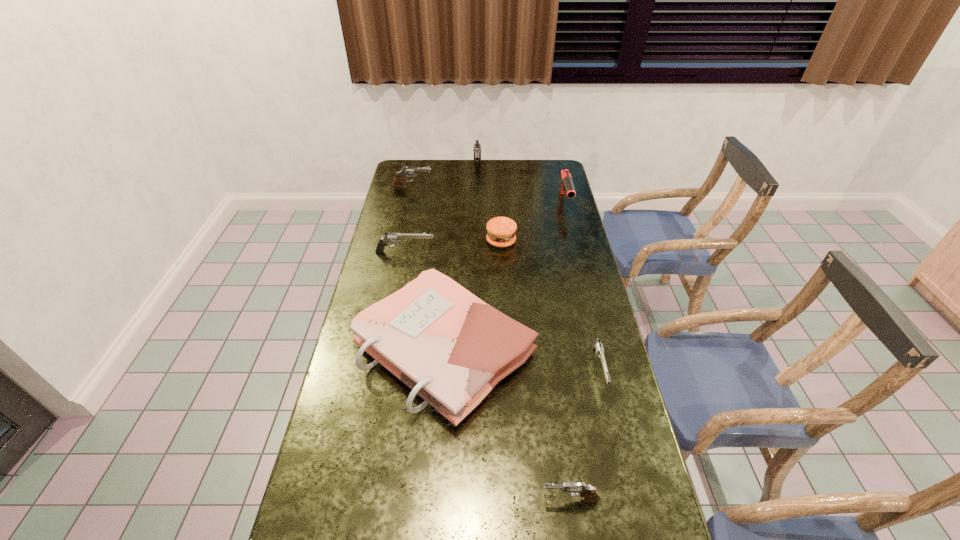
Find the location of `blank space located 0.260m at the barrel of the nearest pistol`. blank space located 0.260m at the barrel of the nearest pistol is located at coordinates (429, 500).

Locate an element on the screen. vacant region located at the barrel of the nearest pistol is located at coordinates (391, 500).

Identify the location of vacant space situated 0.240m on the front-facing side of the right silver pistol. The height and width of the screenshot is (540, 960). (626, 484).

Image resolution: width=960 pixels, height=540 pixels. Find the location of `object at the far edge`. object at the far edge is located at coordinates (477, 147).

This screenshot has width=960, height=540. In order to click on phonebook located in the left edge section of the desktop in this screenshot , I will do `click(448, 346)`.

Where is `gun at the right edge`? gun at the right edge is located at coordinates (566, 184).

At what (x,y) coordinates should I click in order to perform the action: click on vacant space at the far edge of the desktop. Please return your answer as a coordinate pair (x, y). Image resolution: width=960 pixels, height=540 pixels. Looking at the image, I should click on (519, 176).

In the image, there is a desktop. Where is `vacant space at the left edge`? The height and width of the screenshot is (540, 960). vacant space at the left edge is located at coordinates (389, 384).

Locate an element on the screen. free space at the right edge is located at coordinates (549, 206).

Locate an element on the screen. The image size is (960, 540). free space at the far left corner is located at coordinates (421, 177).